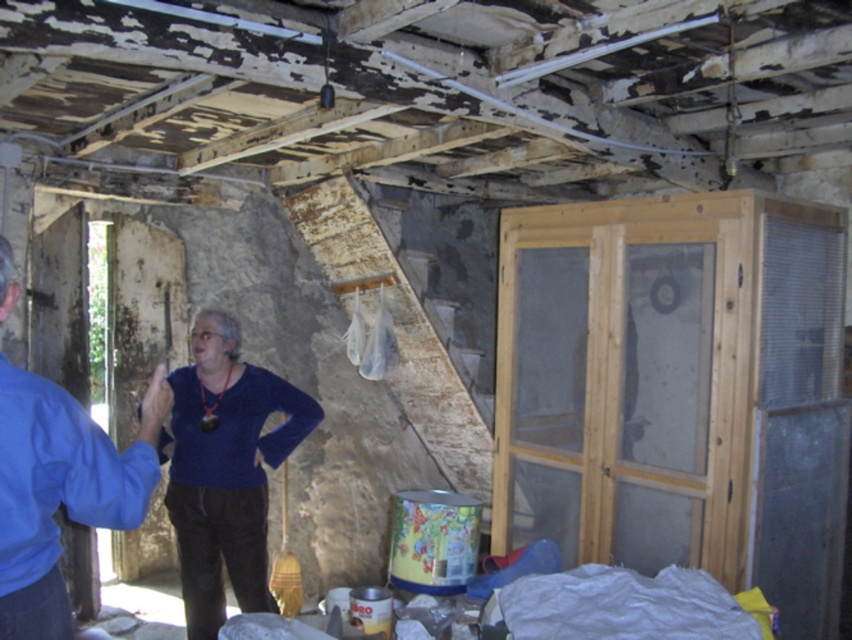
Consider the image. You are a fashion designer observing two blue garments in a room. The blue velvet sweater at center and the blue fabric shirt at left. Which garment is located to the left of the other?

The blue velvet sweater at center is positioned on the left side of blue fabric shirt at left, so the blue velvet sweater at center is to the left of the blue fabric shirt at left.

You are a contractor inspecting the room and need to determine the distance between two points marked in the image. The points are located at coordinates point [181,525] and point [58,417]. Which point is closer to the camera?

Point [58,417] is closer to the camera because it is positioned behind point [181,525], which is further away from the camera.